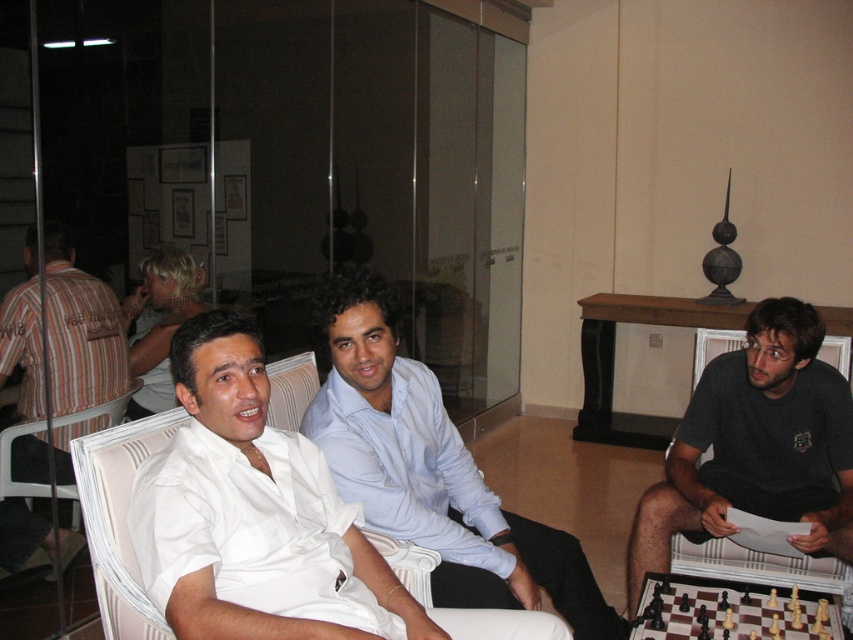
The width and height of the screenshot is (853, 640). I want to click on wooden chess set at lower right, so click(721, 609).

Based on the photo, does wooden chess set at lower right appear under white fabric armchair at left?

Yes.

Between point (653, 586) and point (51, 420), which one is positioned behind?

The point (51, 420) is more distant.

Locate an element on the screen. Image resolution: width=853 pixels, height=640 pixels. wooden chess set at lower right is located at coordinates (721, 609).

Is point (22, 513) less distant than point (114, 417)?

Yes, it is.

Measure the distance between point (94, 424) and camera.

The distance of point (94, 424) from camera is 3.03 meters.

Between point (22, 420) and point (38, 486), which one is positioned in front?

Positioned in front is point (38, 486).

Find the location of a particular element. striped cotton shirt at left is located at coordinates (80, 330).

Looking at this image, measure the distance between dark gray t-shirt at lower right and striped cotton shirt at left.

dark gray t-shirt at lower right and striped cotton shirt at left are 7.00 feet apart.

In order to click on dark gray t-shirt at lower right in this screenshot , I will do `click(753, 444)`.

At what (x,y) coordinates should I click in order to perform the action: click on dark gray t-shirt at lower right. Please return your answer as a coordinate pair (x, y). The image size is (853, 640). Looking at the image, I should click on (753, 444).